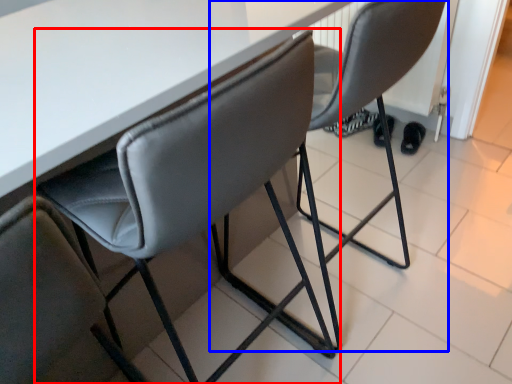
Question: Among these objects, which one is nearest to the camera, chair (highlighted by a red box) or chair (highlighted by a blue box)?

Choices:
 (A) chair
 (B) chair

Answer: (A)